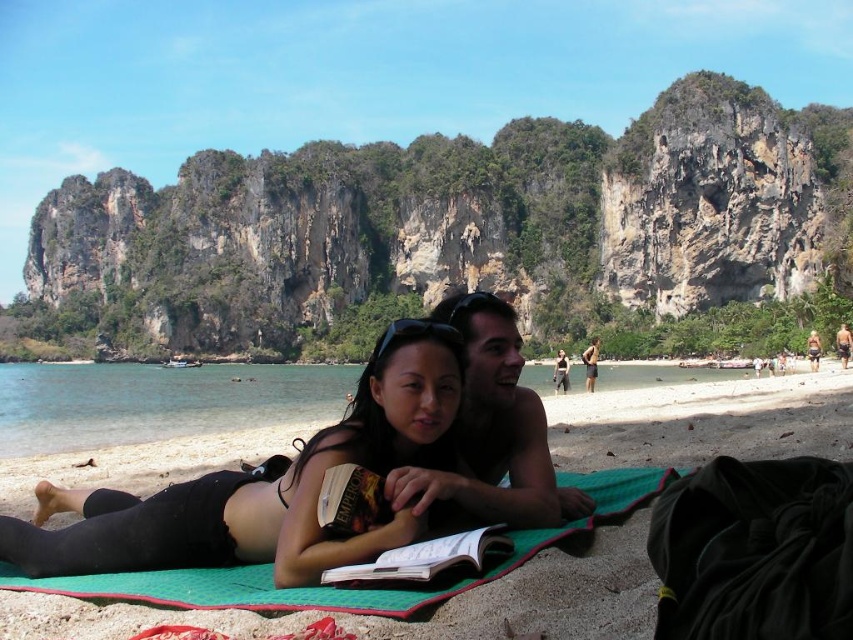
Between point (20, 445) and point (509, 470), which one is positioned in front?

Point (509, 470)

Looking at this image, does green fabric at center appear on the right side of smooth tan skin at center?

No, green fabric at center is not to the right of smooth tan skin at center.

What do you see at coordinates (152, 420) in the screenshot? This screenshot has height=640, width=853. I see `green fabric at center` at bounding box center [152, 420].

Where is `green fabric at center`? green fabric at center is located at coordinates (152, 420).

From the picture: Is black matte bikini top at center in front of smooth tan skin at center?

Yes, it is.

Between black matte bikini top at center and smooth tan skin at center, which one appears on the left side from the viewer's perspective?

black matte bikini top at center is more to the left.

Is point (381, 493) farther from camera compared to point (485, 337)?

That is False.

Identify the location of black matte bikini top at center. This screenshot has width=853, height=640. [x=268, y=486].

Does green fabric at center have a lesser height compared to black matte bikini top at center?

Indeed, green fabric at center has a lesser height compared to black matte bikini top at center.

Which is more to the right, green fabric at center or black matte bikini top at center?

Positioned to the right is black matte bikini top at center.

What are the coordinates of `green fabric at center` in the screenshot? It's located at (152, 420).

You are a GUI agent. You are given a task and a screenshot of the screen. Output one action in this format:
    pyautogui.click(x=<x>, y=<y>)
    Task: Click on the green fabric at center
    The image size is (853, 640).
    Given the screenshot: What is the action you would take?
    pyautogui.click(x=152, y=420)